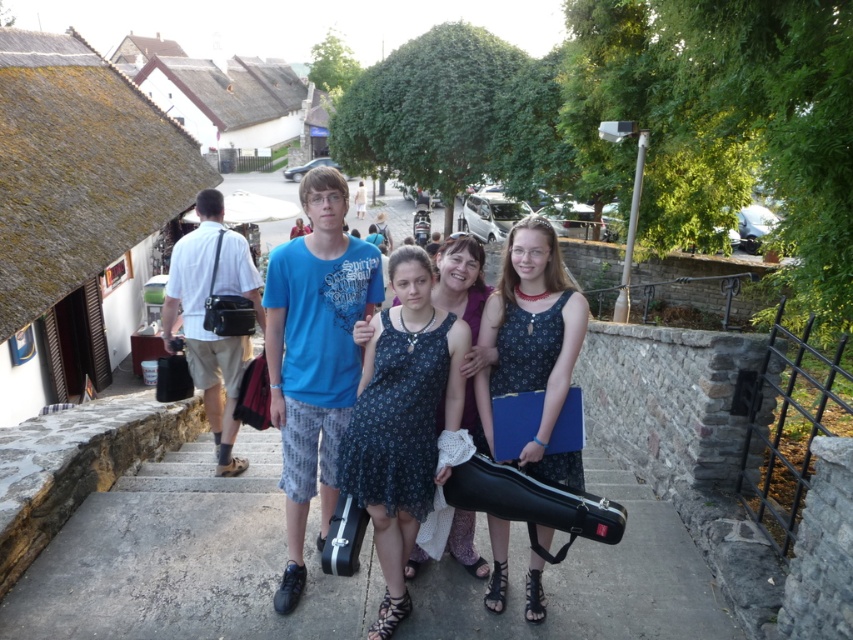
Question: Which point is farther from the camera taking this photo?

Choices:
 (A) (397, 294)
 (B) (509, 333)

Answer: (A)

Question: Is dark blue floral dress at center closer to the viewer compared to matte black guitar case at center?

Choices:
 (A) no
 (B) yes

Answer: (A)

Question: Can you confirm if dark blue floral dress at center is wider than matte black guitar case at center?

Choices:
 (A) no
 (B) yes

Answer: (B)

Question: Is dark blue floral dress at center closer to camera compared to matte black guitar case at center?

Choices:
 (A) no
 (B) yes

Answer: (A)